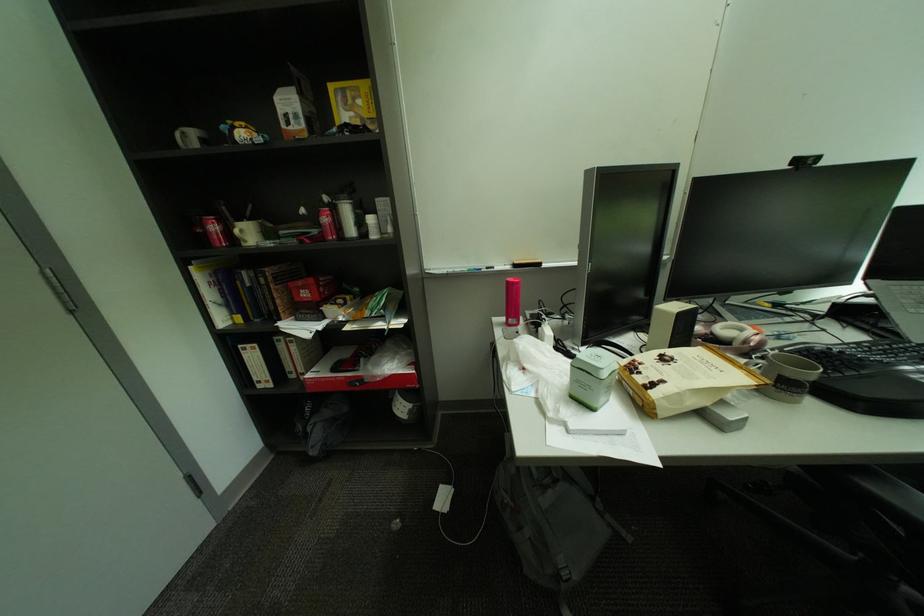
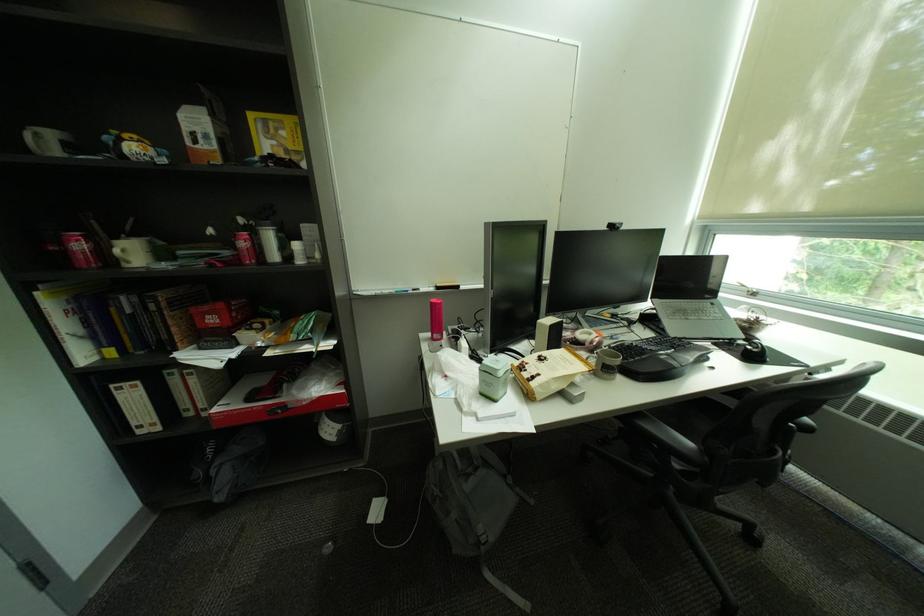
In the second image, find the point that corresponds to (504,320) in the first image.

(431, 334)